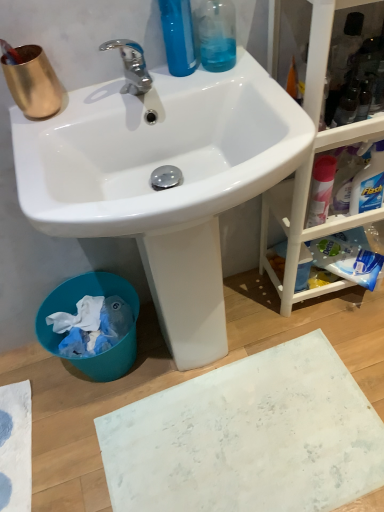
Question: Is white matte bath mat at lower center thinner than white glossy sink at upper center?

Choices:
 (A) no
 (B) yes

Answer: (A)

Question: Does white matte bath mat at lower center appear on the right side of white glossy sink at upper center?

Choices:
 (A) no
 (B) yes

Answer: (B)

Question: From a real-world perspective, is white matte bath mat at lower center under white glossy sink at upper center?

Choices:
 (A) yes
 (B) no

Answer: (A)

Question: Is white matte bath mat at lower center looking in the opposite direction of white glossy sink at upper center?

Choices:
 (A) yes
 (B) no

Answer: (A)

Question: From the image's perspective, is white matte bath mat at lower center over white glossy sink at upper center?

Choices:
 (A) yes
 (B) no

Answer: (B)

Question: Is pink matte spray can at right taller or shorter than white wood cabinet at right?

Choices:
 (A) tall
 (B) short

Answer: (B)

Question: Is pink matte spray can at right bigger or smaller than white wood cabinet at right?

Choices:
 (A) big
 (B) small

Answer: (B)

Question: Relative to white wood cabinet at right, is pink matte spray can at right in front or behind?

Choices:
 (A) behind
 (B) front

Answer: (A)

Question: Does point tap(319, 212) appear closer or farther from the camera than point tap(292, 276)?

Choices:
 (A) farther
 (B) closer

Answer: (B)

Question: Is point (223, 42) closer or farther from the camera than point (321, 137)?

Choices:
 (A) closer
 (B) farther

Answer: (B)

Question: From a real-world perspective, relative to white wood cabinet at right, is transparent plastic bottle at upper center vertically above or below?

Choices:
 (A) below
 (B) above

Answer: (B)

Question: Would you say transparent plastic bottle at upper center is inside or outside white wood cabinet at right?

Choices:
 (A) outside
 (B) inside

Answer: (A)

Question: In the image, is transparent plastic bottle at upper center on the left side or the right side of white wood cabinet at right?

Choices:
 (A) right
 (B) left

Answer: (B)

Question: Considering the relative positions of gold metallic cup at upper left and white matte bath mat at lower center in the image provided, is gold metallic cup at upper left to the left or to the right of white matte bath mat at lower center?

Choices:
 (A) right
 (B) left

Answer: (B)

Question: Relative to white matte bath mat at lower center, is gold metallic cup at upper left in front or behind?

Choices:
 (A) front
 (B) behind

Answer: (A)